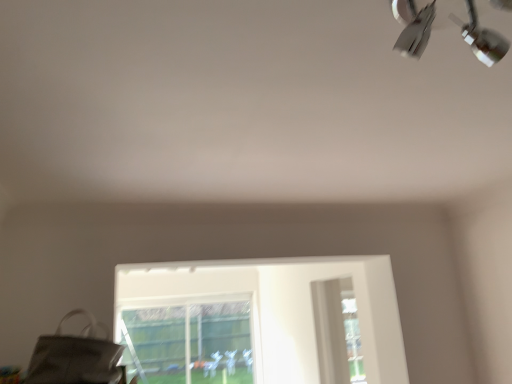
Question: Considering the positions of point (74, 309) and point (462, 1), is point (74, 309) closer or farther from the camera than point (462, 1)?

Choices:
 (A) closer
 (B) farther

Answer: (B)

Question: Is matte gray messenger bag at lower left situated inside metallic silver lamp at upper right or outside?

Choices:
 (A) outside
 (B) inside

Answer: (A)

Question: Considering the real-world distances, which object is farthest from the metallic silver lamp at upper right?

Choices:
 (A) transparent glass bay window at lower center
 (B) matte gray messenger bag at lower left

Answer: (A)

Question: Which object is positioned closest to the matte gray messenger bag at lower left?

Choices:
 (A) metallic silver lamp at upper right
 (B) transparent glass bay window at lower center

Answer: (A)